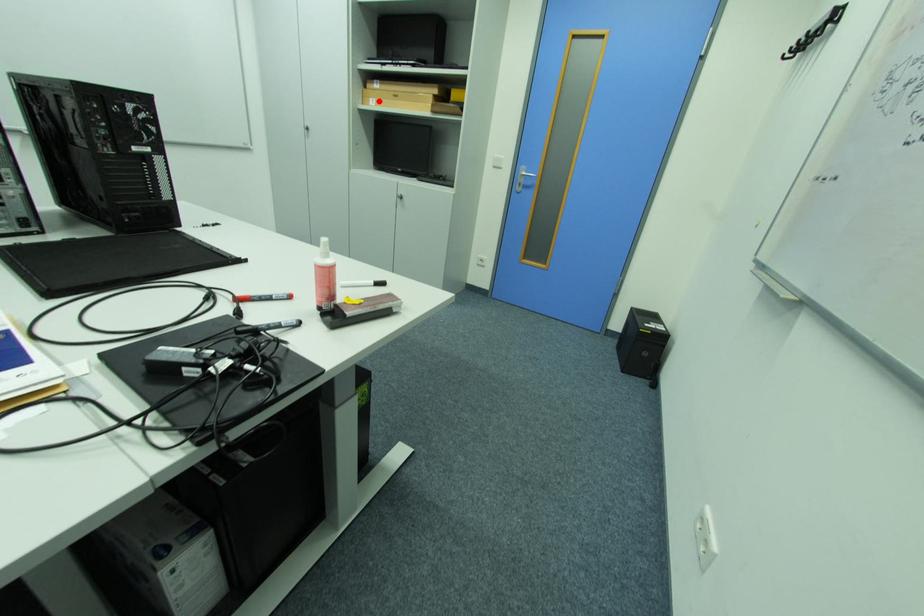
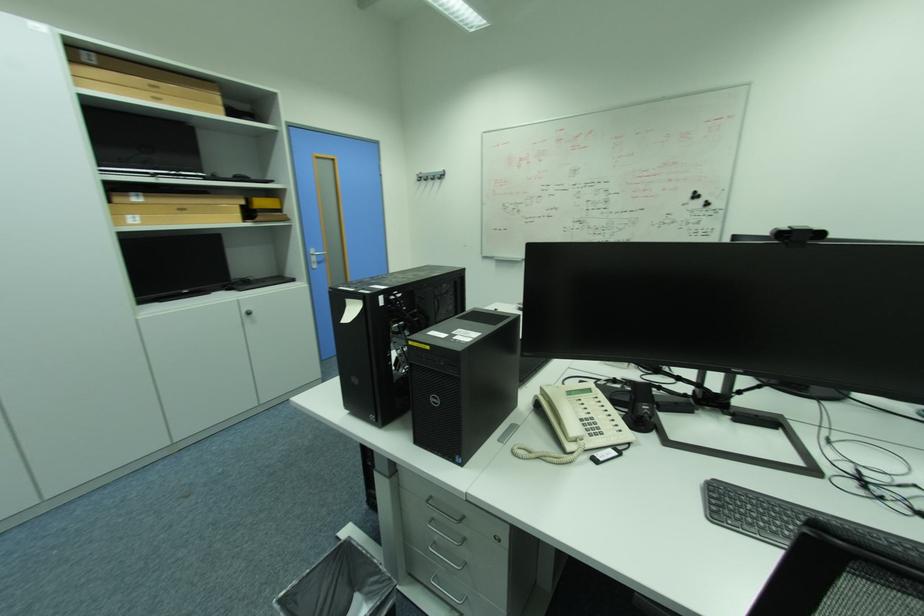
Locate, in the second image, the point that corresponds to the highlighted location in the first image.

(136, 217)